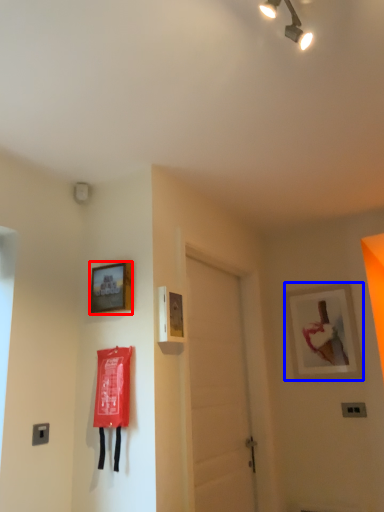
Question: Among these objects, which one is nearest to the camera, picture frame (highlighted by a red box) or picture frame (highlighted by a blue box)?

Choices:
 (A) picture frame
 (B) picture frame

Answer: (A)